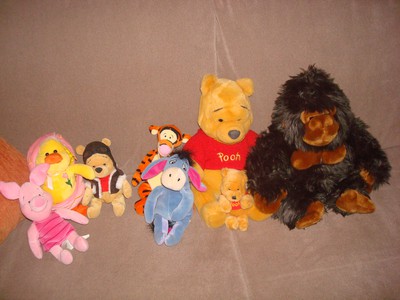
Locate an element on the screen. This screenshot has height=300, width=400. teddy bears is located at coordinates (325, 140), (229, 119), (232, 201), (168, 195), (151, 150), (104, 174), (64, 178), (42, 216).